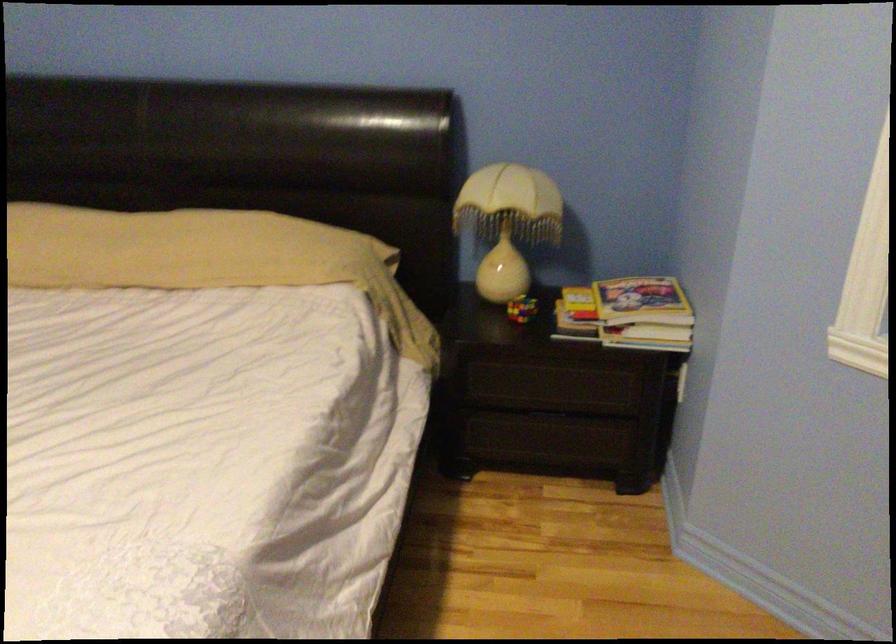
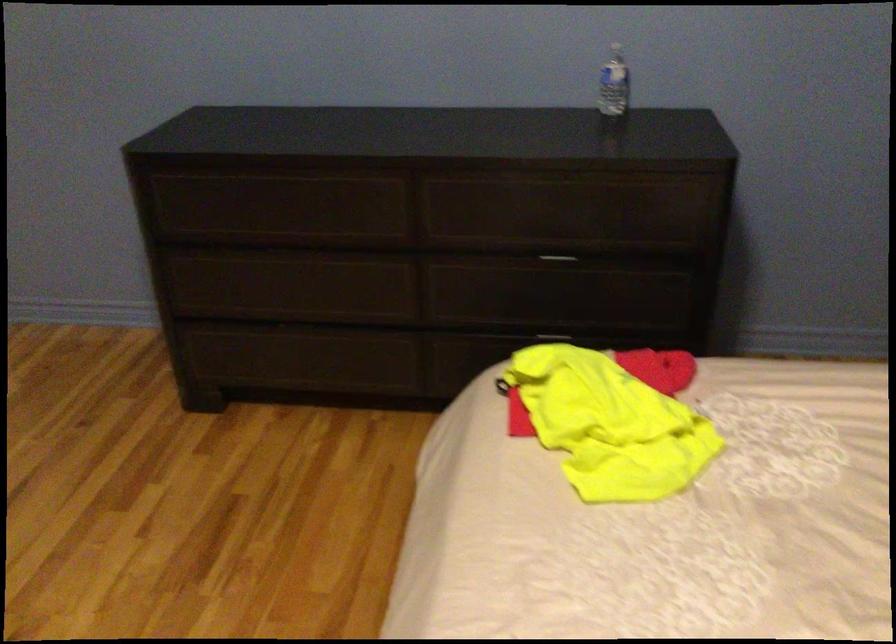
The first image is from the beginning of the video and the second image is from the end. How did the camera likely rotate when shooting the video?

The camera rotated toward left-down.